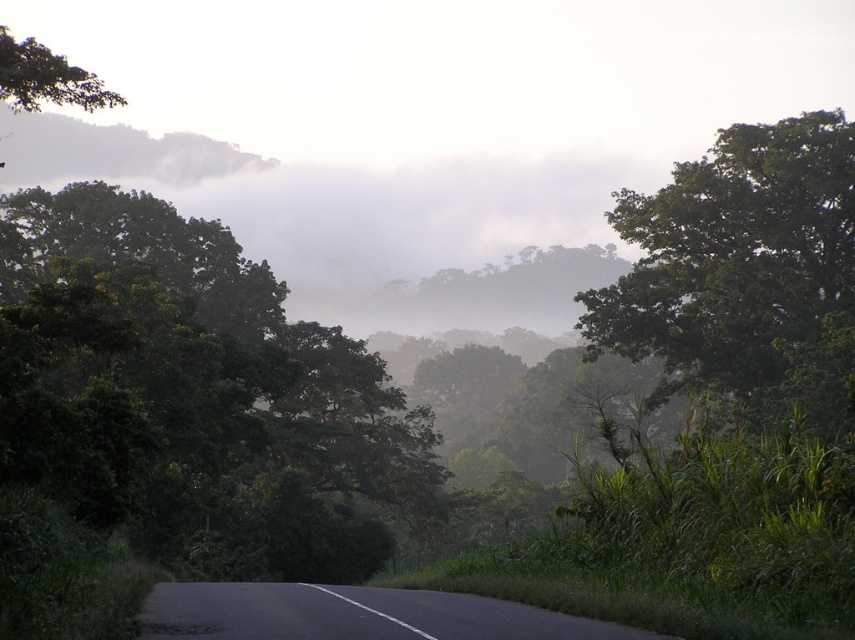
You are standing at the center of the road in the image. Which direction should you walk to reach the green leafy tree at left?

The green leafy tree at left is located at point (195, 396), which is to your left side. Therefore, you should walk to your left to reach it.